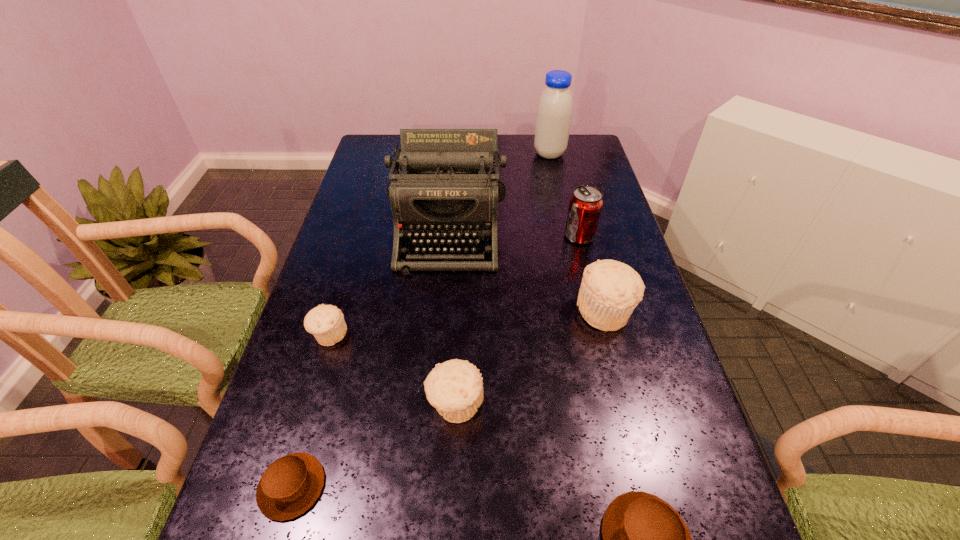
The image size is (960, 540). I want to click on blue soya milk, so click(554, 112).

You are a GUI agent. You are given a task and a screenshot of the screen. Output one action in this format:
    pyautogui.click(x=<x>, y=<y>)
    Task: Click on the soya milk
    The width and height of the screenshot is (960, 540).
    Given the screenshot: What is the action you would take?
    pyautogui.click(x=554, y=112)

Where is `typewriter`? This screenshot has height=540, width=960. typewriter is located at coordinates [445, 188].

This screenshot has height=540, width=960. Find the location of `pop soda`. pop soda is located at coordinates (586, 202).

Find the location of a particular element. The height and width of the screenshot is (540, 960). the biggest beige muffin is located at coordinates [610, 290].

Where is `the rightmost beige muffin`? The width and height of the screenshot is (960, 540). the rightmost beige muffin is located at coordinates (610, 290).

Where is `the third muffin from right to left`? This screenshot has width=960, height=540. the third muffin from right to left is located at coordinates (455, 388).

This screenshot has width=960, height=540. I want to click on the second beige muffin from left to right, so click(455, 388).

Identify the location of the smallest beige muffin. The height and width of the screenshot is (540, 960). (326, 322).

This screenshot has height=540, width=960. I want to click on the left brown muffin, so [x=290, y=485].